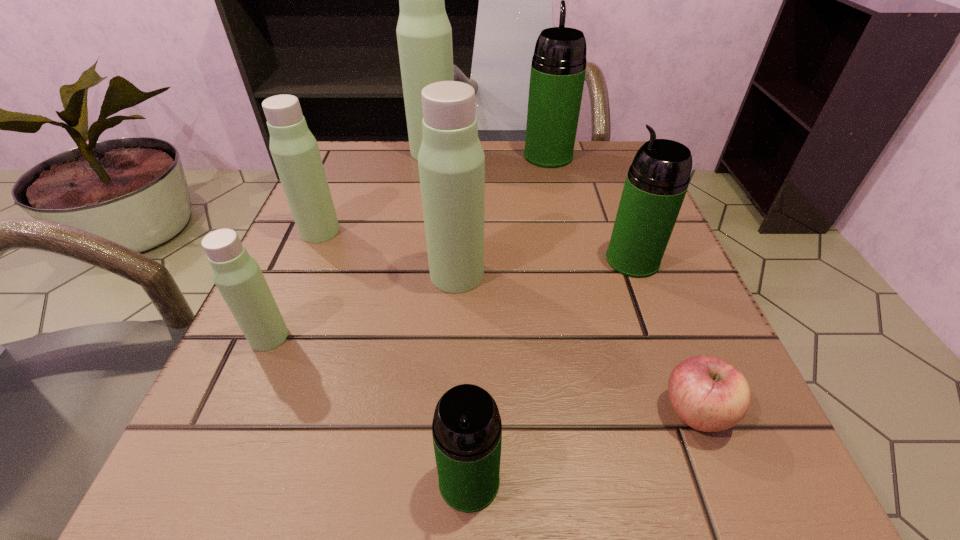
At what (x,y) coordinates should I click in order to perform the action: click on vacant region located 0.270m on the back of the sixth farthest object. Please return your answer as a coordinate pair (x, y). The height and width of the screenshot is (540, 960). Looking at the image, I should click on (323, 214).

The image size is (960, 540). In order to click on vacant space located 0.130m on the left of the second nearest object in this screenshot , I will do `click(556, 413)`.

Locate an element on the screen. The width and height of the screenshot is (960, 540). thermos bottle at the near edge is located at coordinates (467, 430).

Image resolution: width=960 pixels, height=540 pixels. I want to click on apple present at the near edge, so click(x=708, y=394).

At what (x,y) coordinates should I click in order to perform the action: click on apple at the right edge. Please return your answer as a coordinate pair (x, y). This screenshot has height=540, width=960. Looking at the image, I should click on (708, 394).

Locate an element on the screen. The width and height of the screenshot is (960, 540). object present at the far right corner is located at coordinates (558, 68).

This screenshot has height=540, width=960. I want to click on object at the near right corner, so click(x=708, y=394).

In the image, there is a desktop. Where is `vacant space at the far edge`? The width and height of the screenshot is (960, 540). vacant space at the far edge is located at coordinates (505, 164).

Locate an element on the screen. vacant area at the left edge of the desktop is located at coordinates (309, 292).

Where is `free spot at the right edge of the desktop`? This screenshot has height=540, width=960. free spot at the right edge of the desktop is located at coordinates (612, 372).